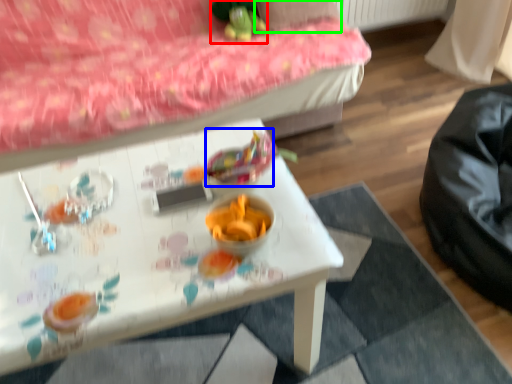
Question: Estimate the real-world distances between objects in this image. Which object is closer to toy (highlighted by a red box), food (highlighted by a blue box) or pillow (highlighted by a green box)?

Choices:
 (A) food
 (B) pillow

Answer: (B)